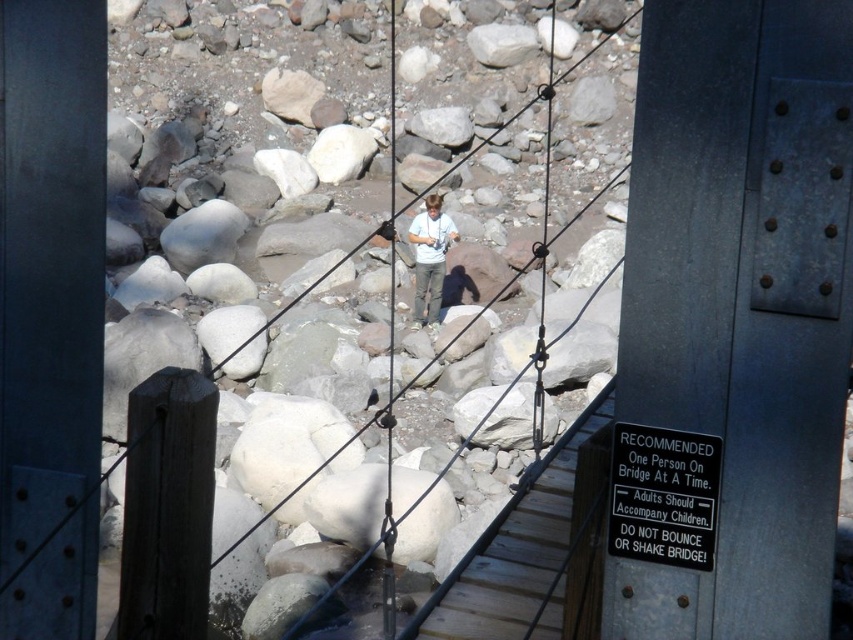
Question: Is wooden at center wider than light blue shirt at center?

Choices:
 (A) yes
 (B) no

Answer: (A)

Question: Which point is farther from the camera taking this photo?

Choices:
 (A) (410, 202)
 (B) (438, 260)

Answer: (A)

Question: Can you confirm if wooden at center is wider than light blue shirt at center?

Choices:
 (A) yes
 (B) no

Answer: (A)

Question: Which point is farther to the camera?

Choices:
 (A) (424, 198)
 (B) (231, 545)

Answer: (A)

Question: Can you confirm if wooden at center is positioned below light blue shirt at center?

Choices:
 (A) no
 (B) yes

Answer: (A)

Question: Which object is farther from the camera taking this photo?

Choices:
 (A) wooden at center
 (B) light blue shirt at center

Answer: (B)